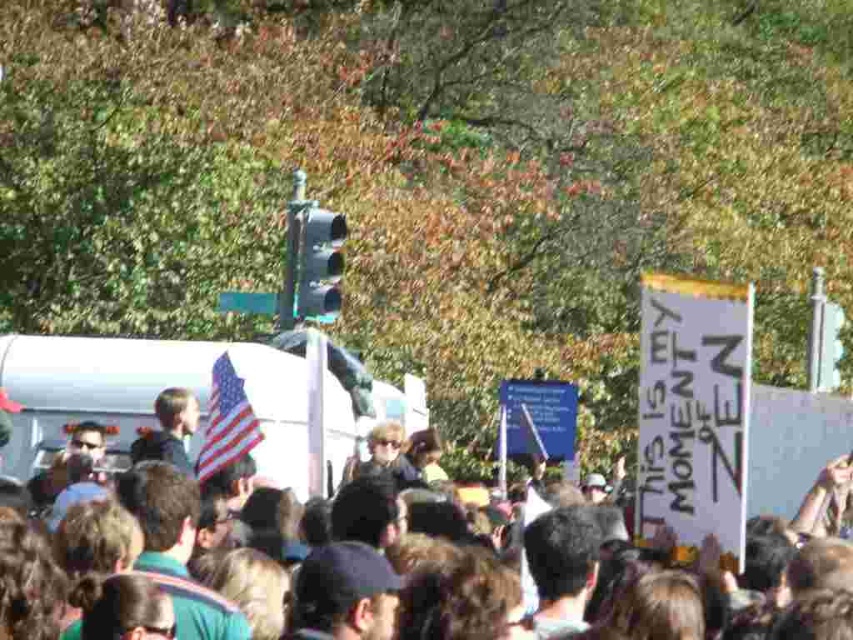
Is point (799, 392) positioned behind point (207, 456)?

Yes, point (799, 392) is farther from viewer.

Which is more to the left, white paper sign at center or american flag at center?

american flag at center

Does point (757, 442) come behind point (225, 364)?

That is True.

Locate an element on the screen. Image resolution: width=853 pixels, height=640 pixels. white paper sign at center is located at coordinates (791, 444).